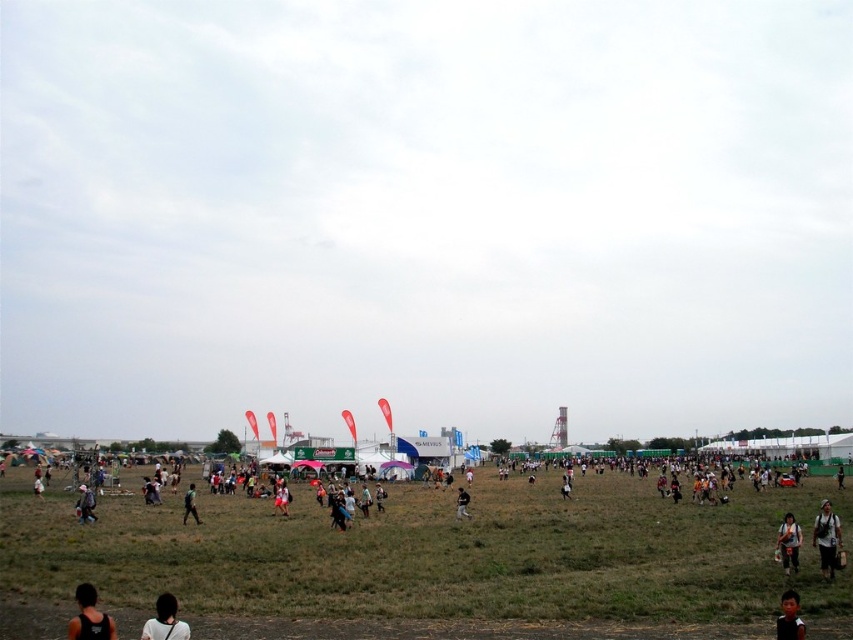
Is white matte shirt at lower left positioned at the back of green matte shirt at center?

No, it is not.

Find the location of `white matte shirt at lower left`. white matte shirt at lower left is located at coordinates (165, 620).

The image size is (853, 640). Describe the element at coordinates (165, 620) in the screenshot. I see `white matte shirt at lower left` at that location.

You are a GUI agent. You are given a task and a screenshot of the screen. Output one action in this format:
    pyautogui.click(x=<x>, y=<y>)
    Task: Click on the white matte shirt at lower left
    Image resolution: width=853 pixels, height=640 pixels.
    Given the screenshot: What is the action you would take?
    pyautogui.click(x=165, y=620)

Can you confirm if orange fabric bag at lower right is smaller than black fabric person at center?

Incorrect, orange fabric bag at lower right is not smaller in size than black fabric person at center.

Is orange fabric bag at lower right below black fabric person at center?

Actually, orange fabric bag at lower right is above black fabric person at center.

Does point (785, 561) lie behind point (466, 493)?

That is False.

Find the location of `orange fabric bag at lower right`. orange fabric bag at lower right is located at coordinates (788, 541).

Does point (86, 611) come in front of point (776, 547)?

Yes.

Which is behind, point (73, 627) or point (779, 540)?

Positioned behind is point (779, 540).

Between point (93, 632) and point (790, 552), which one is positioned behind?

The point (790, 552) is more distant.

This screenshot has height=640, width=853. What are the coordinates of `black fabric shirt at lower left` in the screenshot? It's located at (90, 616).